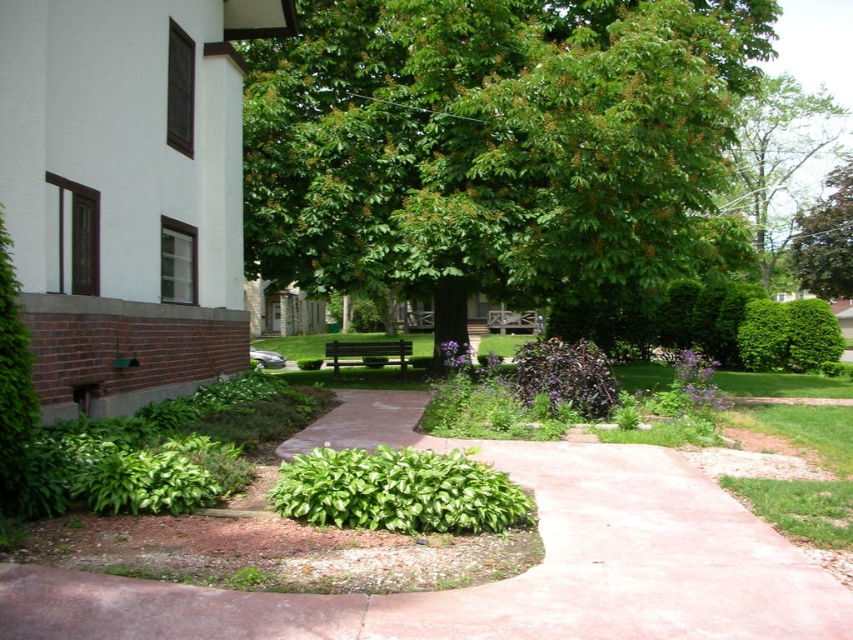
You are standing at the entrance of the house and want to reach the purple matte bush at center. According to the image, in which direction should you walk from your current position to reach the bush?

The purple matte bush at center is located at point (566, 376), so you should walk towards the center of the image from the entrance of the house to reach it.